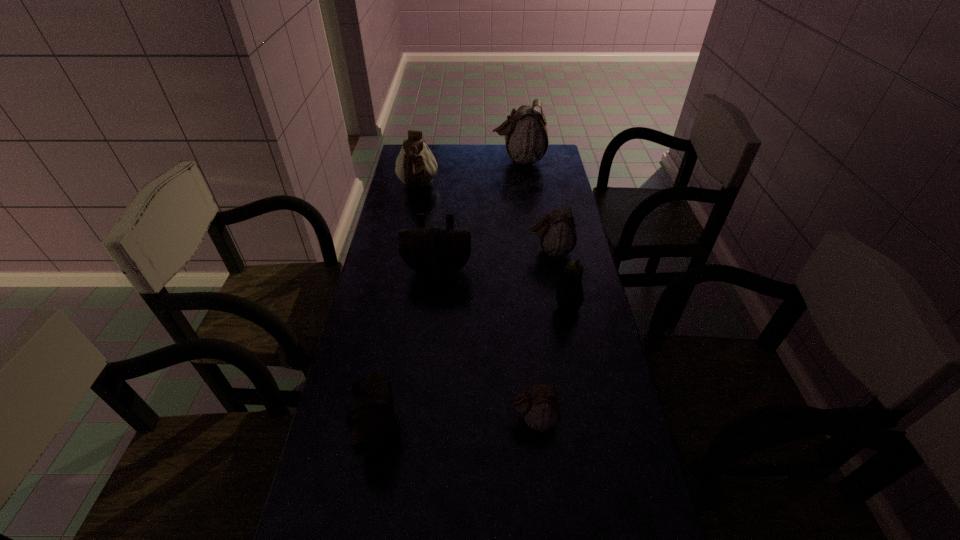
Find the location of a particular element. white pouch that stands as the third closest to the bigger brown pouch is located at coordinates pyautogui.click(x=540, y=407).

Locate which brown pouch is the second closest to the biggest white pouch. Please provide its 2D coordinates. Your answer should be formatted as a tuple, i.e. [(x, y)], where the tuple contains the x and y coordinates of a point satisfying the conditions above.

[(372, 418)]

Select which brown pouch appears as the second closest to the third farthest white pouch. Please provide its 2D coordinates. Your answer should be formatted as a tuple, i.e. [(x, y)], where the tuple contains the x and y coordinates of a point satisfying the conditions above.

[(372, 418)]

I want to click on vacant space that satisfies the following two spatial constraints: 1. with the flap open on the farther brown pouch; 2. on the right side of the eggplant, so click(434, 307).

In order to click on vacant space that satisfies the following two spatial constraints: 1. with the flap open on the farther brown pouch; 2. with the flap open on the smaller brown pouch in this screenshot , I will do `click(421, 433)`.

This screenshot has width=960, height=540. I want to click on vacant space that satisfies the following two spatial constraints: 1. with the flap open on the bigger brown pouch; 2. with the flap open on the nearer brown pouch, so click(x=421, y=433).

The height and width of the screenshot is (540, 960). What are the coordinates of `free spot that satisfies the following two spatial constraints: 1. on the front side of the third nearest object; 2. on the front-facing side of the shortest pouch` in the screenshot? It's located at (588, 419).

Image resolution: width=960 pixels, height=540 pixels. I want to click on free point that satisfies the following two spatial constraints: 1. on the back side of the eggplant; 2. on the front-facing side of the third biggest white pouch, so click(x=557, y=251).

Locate an element on the screen. The image size is (960, 540). free spot that satisfies the following two spatial constraints: 1. on the front-facing side of the tallest object; 2. on the front-facing side of the third nearest white pouch is located at coordinates (522, 187).